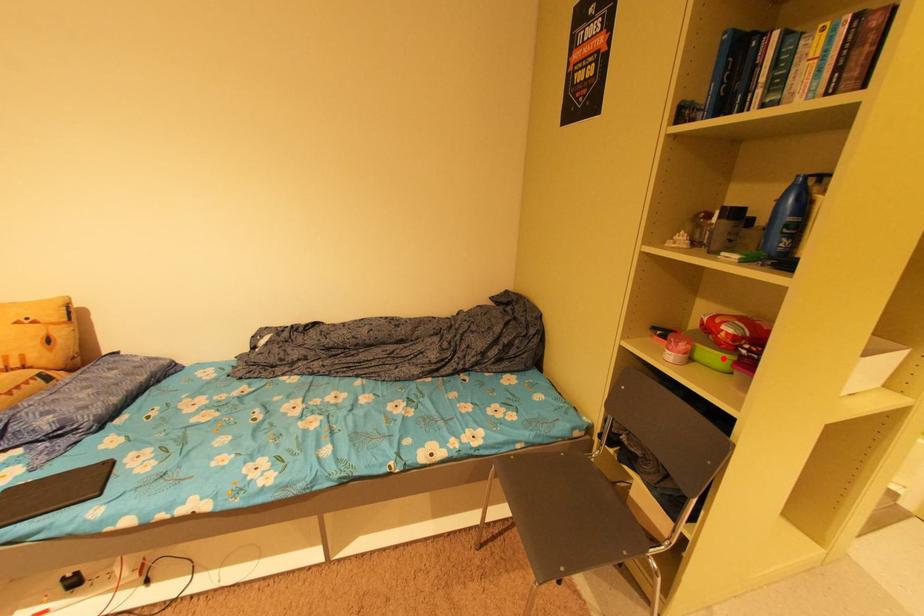
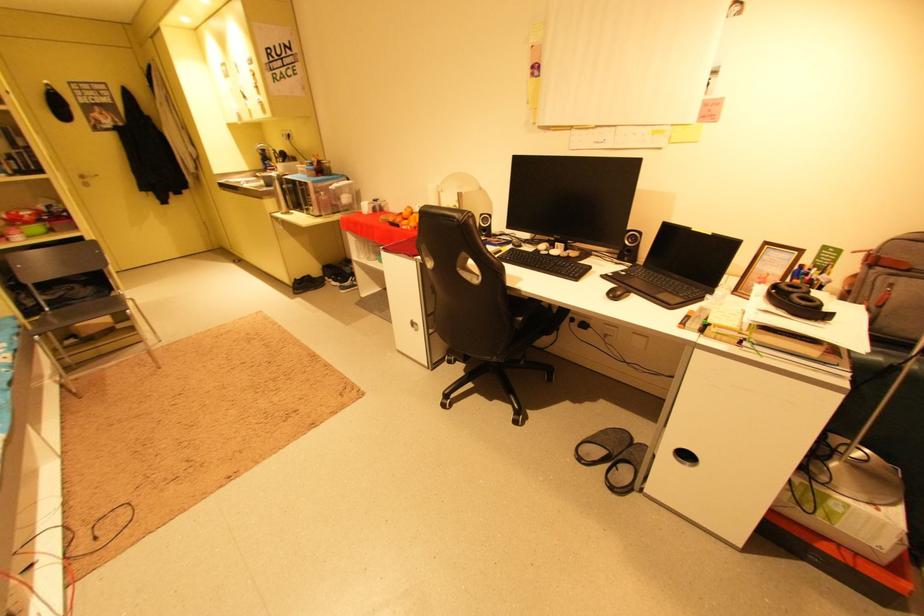
The point at the highlighted location is marked in the first image. Where is the corresponding point in the second image?

(43, 229)